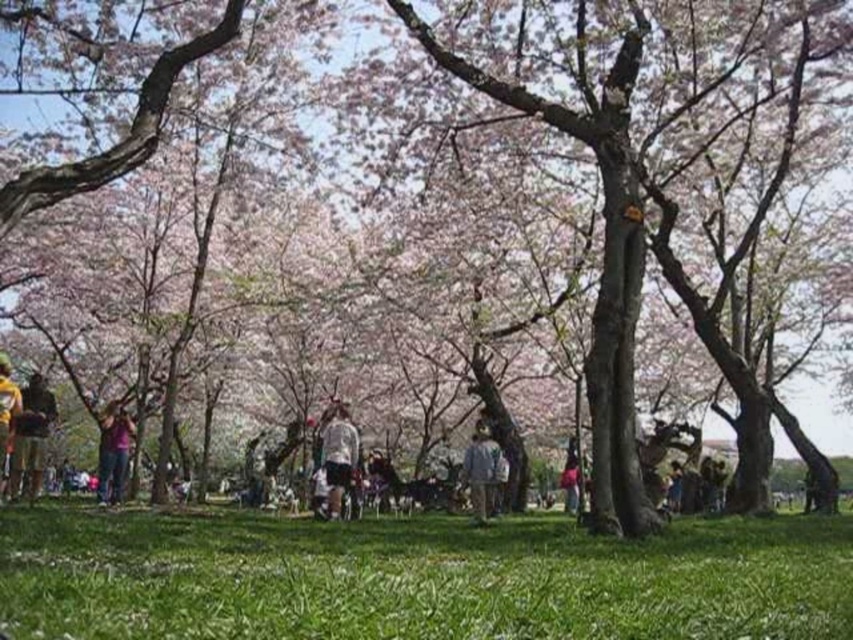
Question: Which point appears farthest from the camera in this image?

Choices:
 (A) (114, 410)
 (B) (479, 460)
 (C) (51, 392)
 (D) (384, 560)

Answer: (C)

Question: Which point appears closest to the camera in this image?

Choices:
 (A) (334, 442)
 (B) (738, 561)
 (C) (486, 484)
 (D) (132, 424)

Answer: (B)

Question: Which object is closer to the camera taking this photo?

Choices:
 (A) yellow fabric shirt at lower left
 (B) yellow fabric bag at lower left

Answer: (B)

Question: Can you confirm if white matte shirt at center is positioned below yellow fabric bag at lower left?

Choices:
 (A) yes
 (B) no

Answer: (A)

Question: Does white matte shirt at center have a smaller size compared to yellow fabric bag at lower left?

Choices:
 (A) no
 (B) yes

Answer: (B)

Question: Is the position of white matte shirt at center less distant than that of matte purple shirt at center?

Choices:
 (A) no
 (B) yes

Answer: (B)